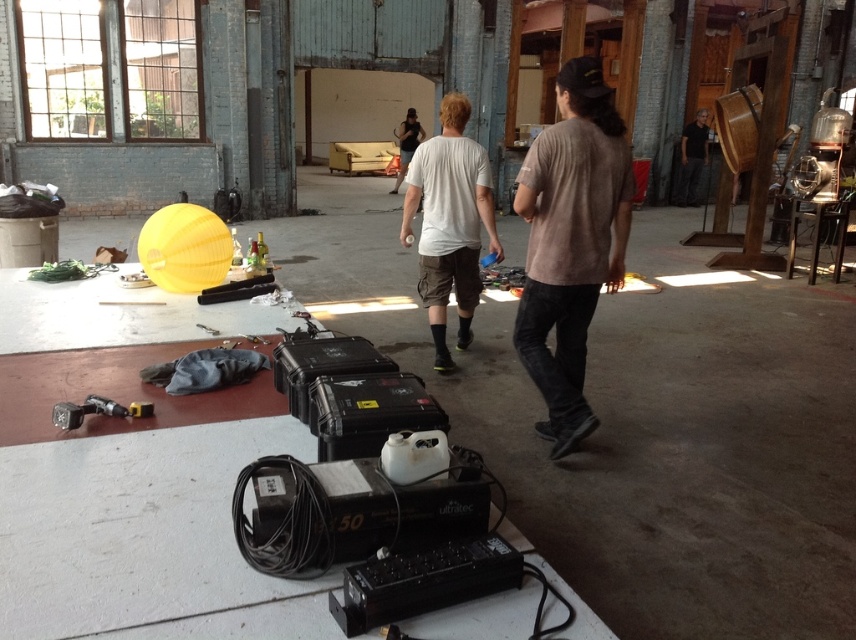
You are a delivery person who needs to place a new package between the dark gray jeans at right and the metallic silver drill at lower left. Can you fit the package there if it measures 1 meter in length?

The dark gray jeans at right is positioned on the right side of metallic silver drill at lower left, so the space between them may vary. However, since the exact distance isn not provided, it is uncertain if the 1 meter package will fit.

You are a delivery person who needs to place a new tool box that is 1.2 meters tall. You see the dark gray jeans at right and the metallic silver drill at lower left. Which object can the tool box fit next to without exceeding its height?

The dark gray jeans at right is much taller than the metallic silver drill at lower left, so the tool box can fit next to the dark gray jeans at right since it can accommodate the height.